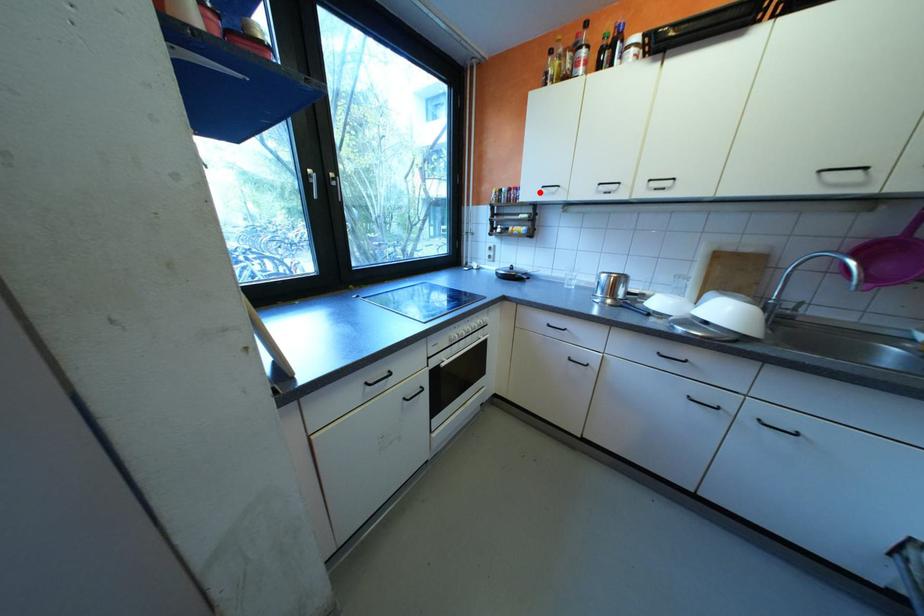
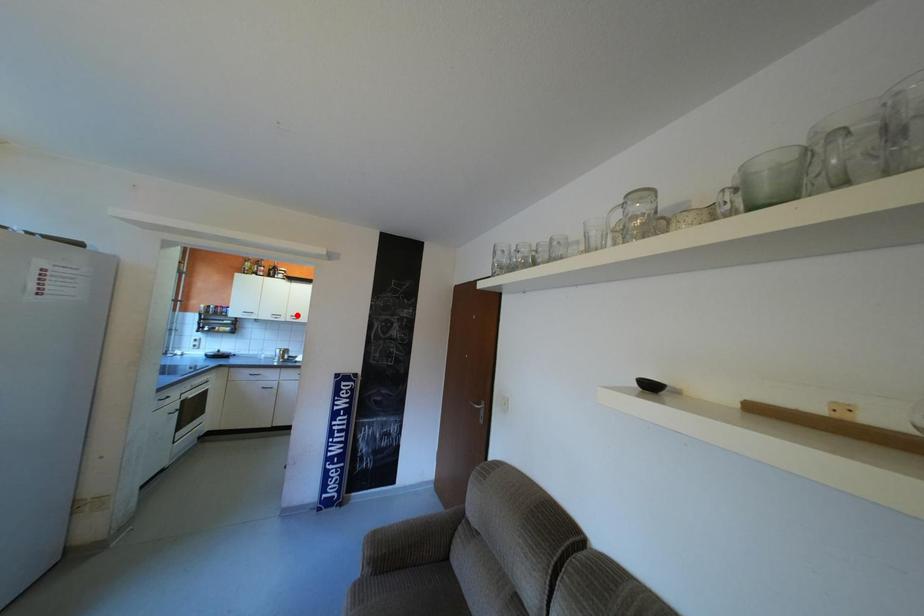
I am providing you with two images of the same scene from different viewpoints. A red point is marked on the first image and another point is marked on the second image. Does the point marked in image1 correspond to the same location as the one in image2?

No